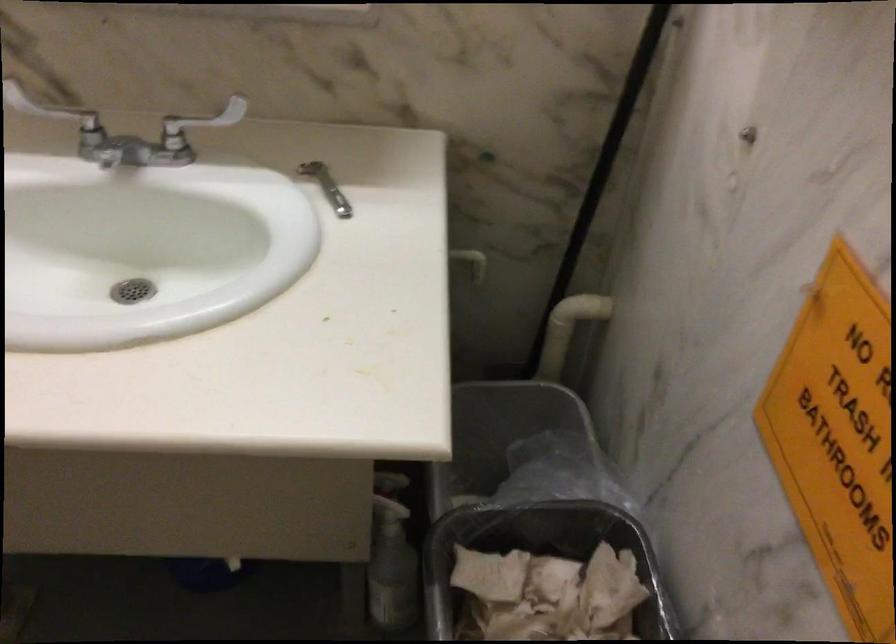
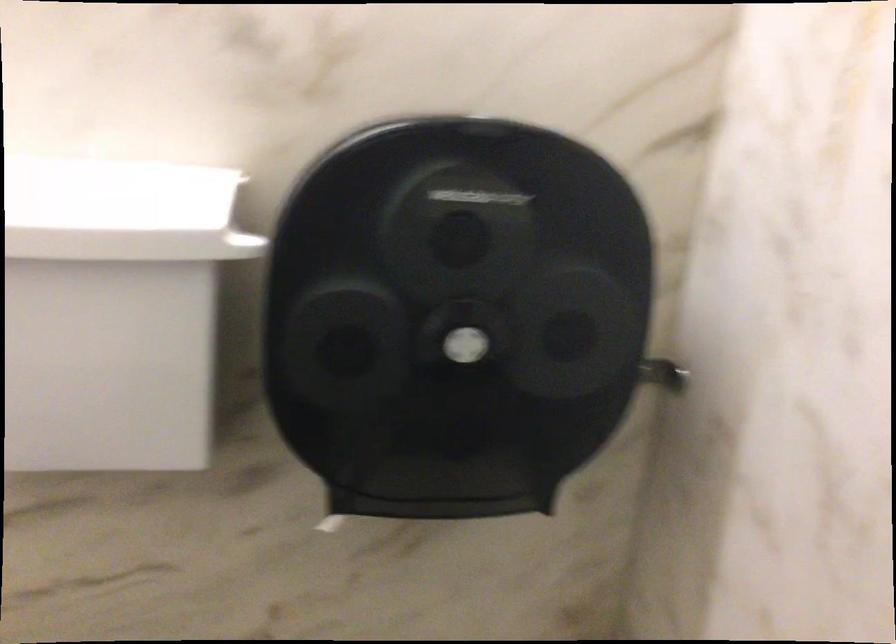
Question: What movement of the cameraman would produce the second image?

Choices:
 (A) Left
 (B) Right
 (C) Forward
 (D) Backward

Answer: (A)